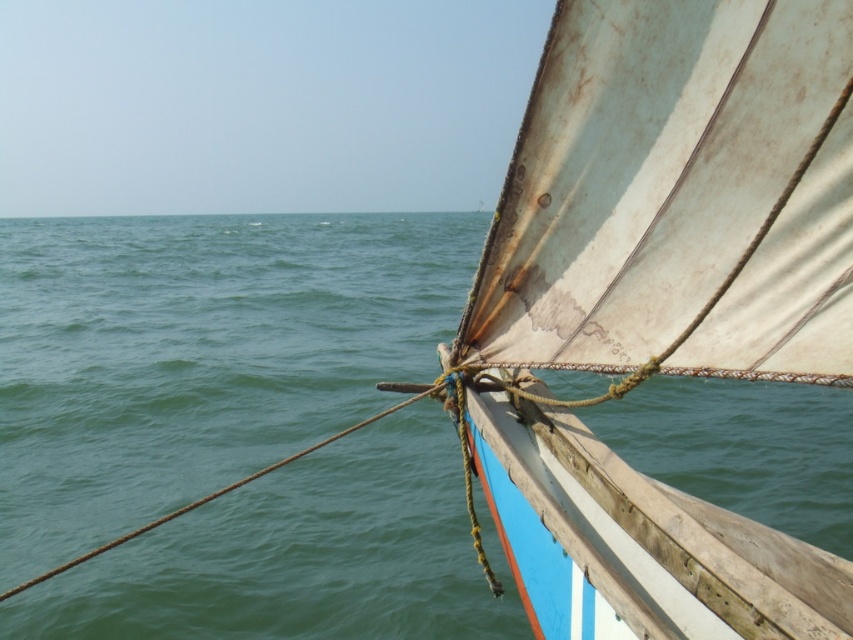
Based on the photo, you are standing on the deck of a small boat and notice the green water at center and the white tattered sail at upper right. Which object is located higher from the water level?

The white tattered sail at upper right is higher than the green water at center because the sail is positioned above the water level on the boat.

You are an observer on the boat looking forward. You see the green water at center and the white tattered sail at upper right. Which object is located to the left of the other?

The green water at center is positioned on the left side of white tattered sail at upper right, so the green water at center is to the left of the white tattered sail at upper right.